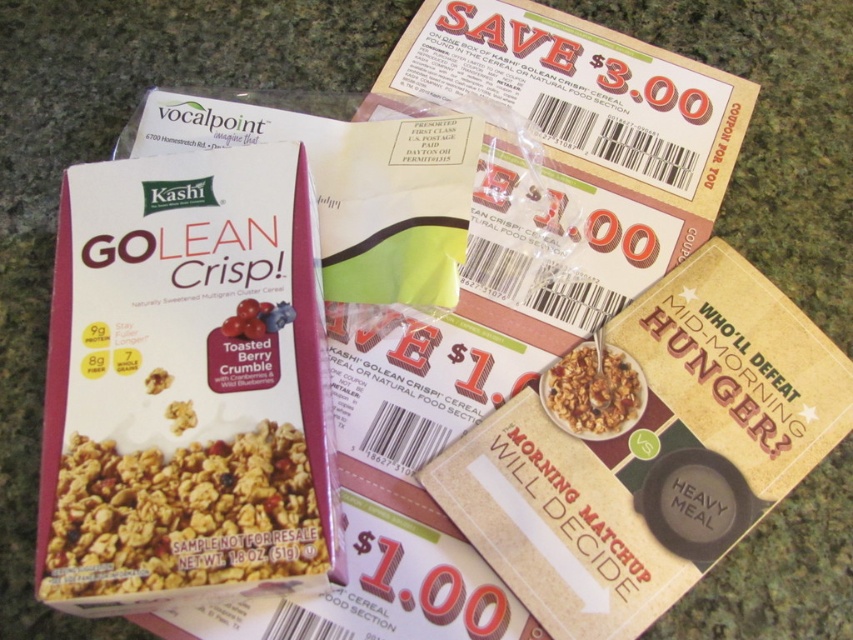
Question: Is matte brown granola at center bigger than granular textured cereal at center?

Choices:
 (A) yes
 (B) no

Answer: (A)

Question: Can you confirm if matte brown granola at center is positioned to the right of granular textured cereal at center?

Choices:
 (A) no
 (B) yes

Answer: (A)

Question: Where is matte brown granola at center located in relation to granular textured cereal at center in the image?

Choices:
 (A) below
 (B) above

Answer: (A)

Question: Which of the following is the farthest from the observer?

Choices:
 (A) (587, 435)
 (B) (312, 502)

Answer: (A)